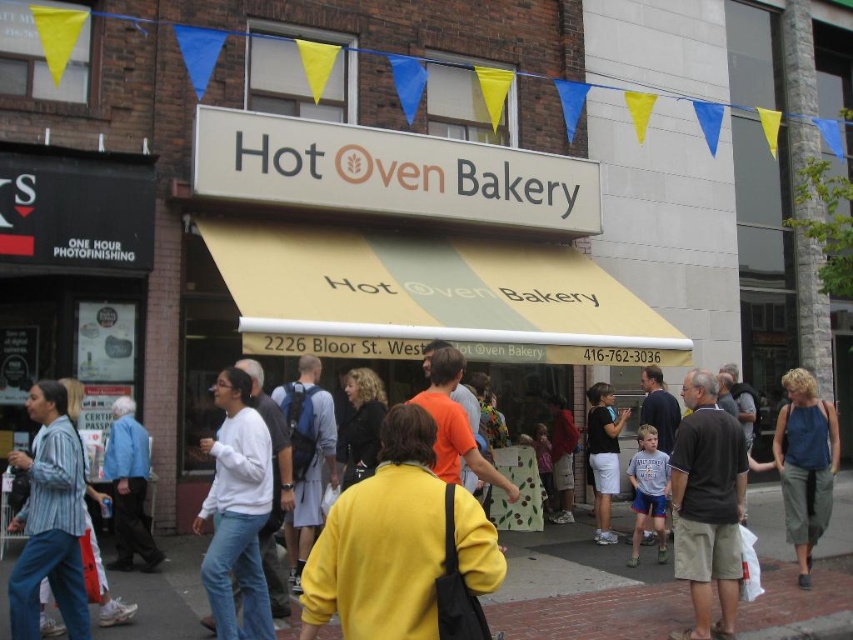
Question: Which of these objects is positioned farthest from the matte blue backpack at center?

Choices:
 (A) white matte sweater at center
 (B) blue cotton shirt at left
 (C) denim blue tank top at right
 (D) brick pavement at center

Answer: (C)

Question: Is striped cotton shirt at left below light blue t-shirt at center?

Choices:
 (A) yes
 (B) no

Answer: (B)

Question: Which object is the farthest from the blue cotton shirt at left?

Choices:
 (A) denim blue tank top at right
 (B) white matte sweater at center
 (C) brick pavement at center

Answer: (A)

Question: Which point is closer to the camera taking this photo?

Choices:
 (A) (131, 531)
 (B) (607, 451)

Answer: (A)

Question: Is striped cotton shirt at left further to the viewer compared to blue cotton shirt at left?

Choices:
 (A) yes
 (B) no

Answer: (B)

Question: Is dark gray cotton shirt at center thinner than denim blue tank top at right?

Choices:
 (A) yes
 (B) no

Answer: (B)